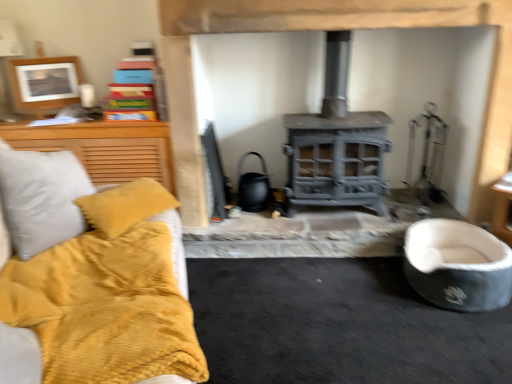
Locate an element on the screen. Image resolution: width=512 pixels, height=384 pixels. free space to the left of soft gray fabric pet bed at lower right is located at coordinates (365, 293).